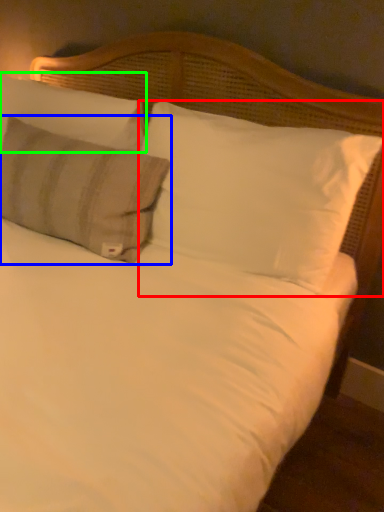
Question: Estimate the real-world distances between objects in this image. Which object is farther from pillow (highlighted by a red box), pillow (highlighted by a blue box) or pillow (highlighted by a green box)?

Choices:
 (A) pillow
 (B) pillow

Answer: (B)